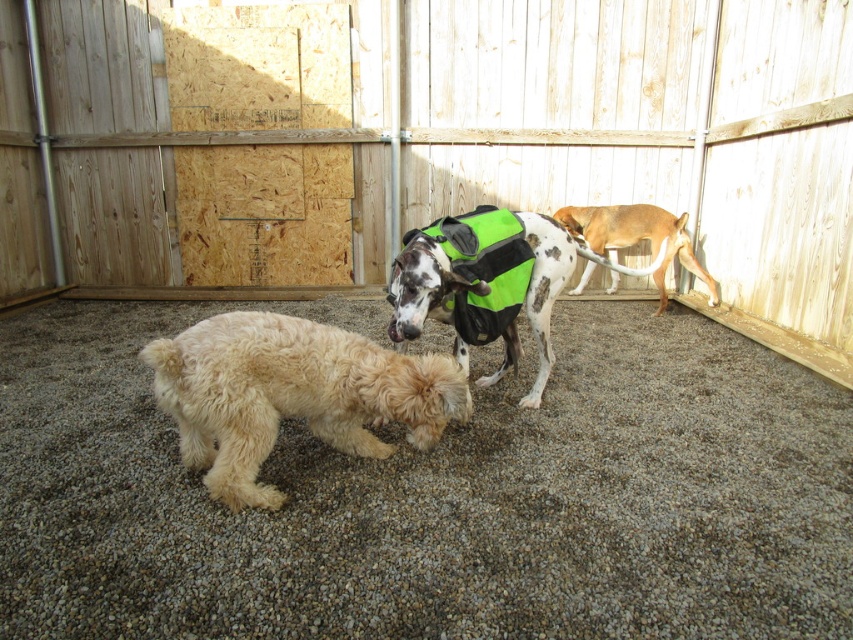
Question: Which point is farther to the camera?

Choices:
 (A) green fabric dog at center
 (B) fuzzy beige dog at lower left

Answer: (A)

Question: Does wooden fence at center lie in front of fuzzy beige dog at lower left?

Choices:
 (A) no
 (B) yes

Answer: (A)

Question: Which of the following is the closest to the observer?

Choices:
 (A) tap(554, 196)
 (B) tap(502, 365)

Answer: (B)

Question: Is wooden fence at center above fuzzy beige dog at lower left?

Choices:
 (A) yes
 (B) no

Answer: (A)

Question: Which point is closer to the camera?

Choices:
 (A) brown fur dog at right
 (B) green fabric dog at center
 (C) wooden fence at center
 (D) fuzzy beige dog at lower left

Answer: (D)

Question: Can you confirm if wooden fence at center is thinner than fuzzy beige dog at lower left?

Choices:
 (A) no
 (B) yes

Answer: (A)